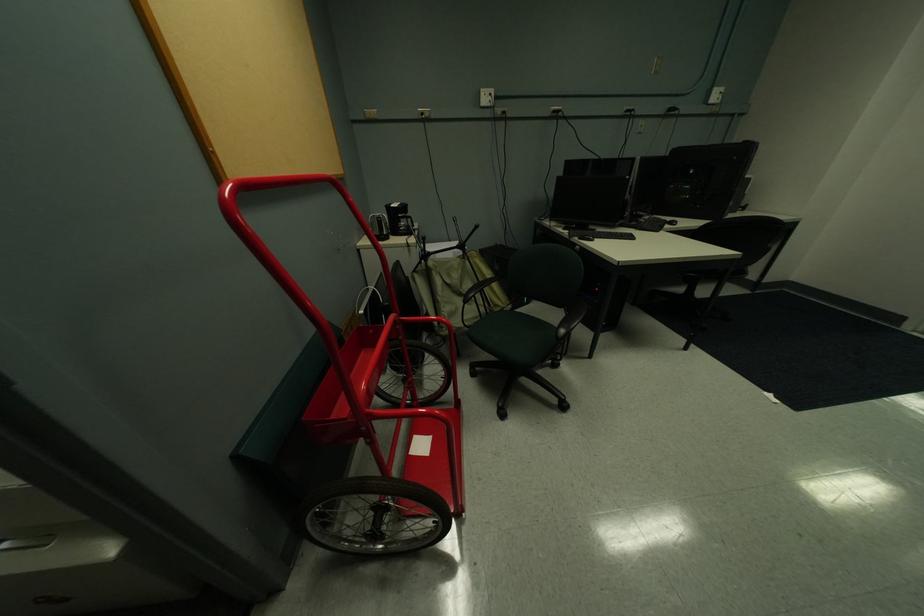
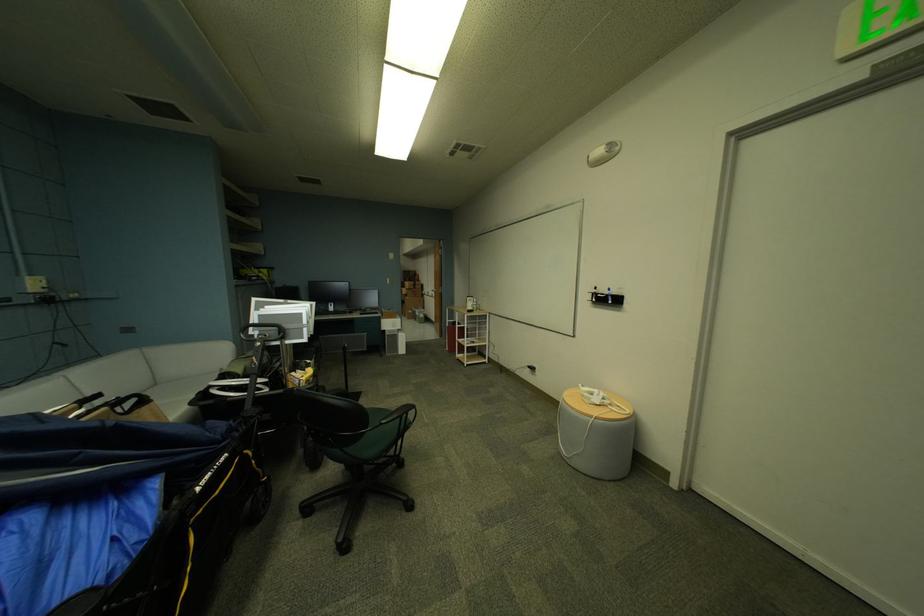
Question: I am providing you with two images of the same scene from different viewpoints. After the viewpoint changes to image2, which objects are now occluded?

Choices:
 (A) roller blind bar
 (B) silver water kettle
 (C) grey sofa sitting surface
 (D) cardboard box

Answer: (B)